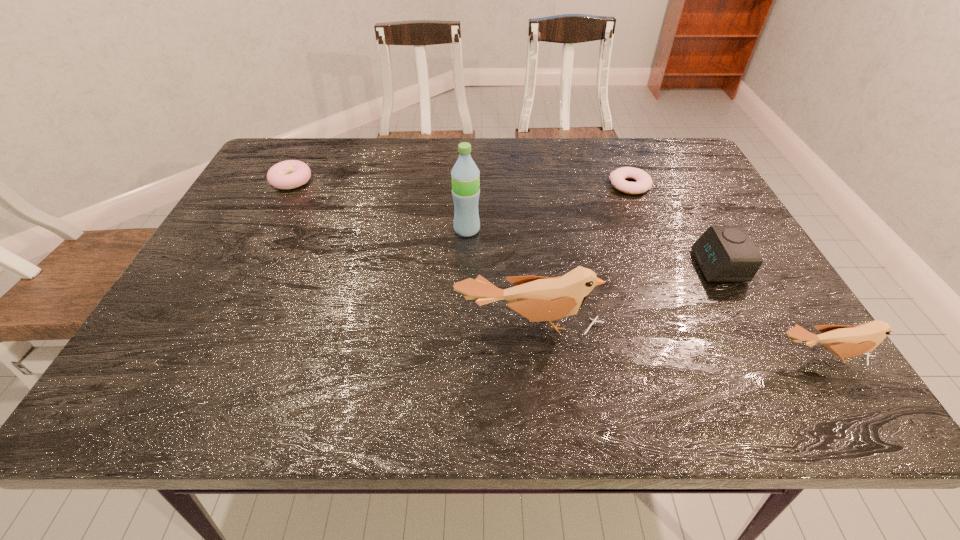
Locate an element on the screen. The width and height of the screenshot is (960, 540). object that can be found as the second closest to the fourth shortest object is located at coordinates (537, 298).

Locate an element on the screen. The width and height of the screenshot is (960, 540). free location that satisfies the following two spatial constraints: 1. on the front side of the second shortest object; 2. on the left side of the shorter doughnut is located at coordinates (289, 185).